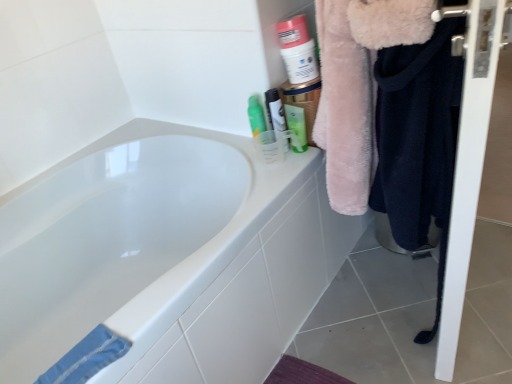
I want to click on free space to the left of white glossy screen door at right, so click(x=369, y=307).